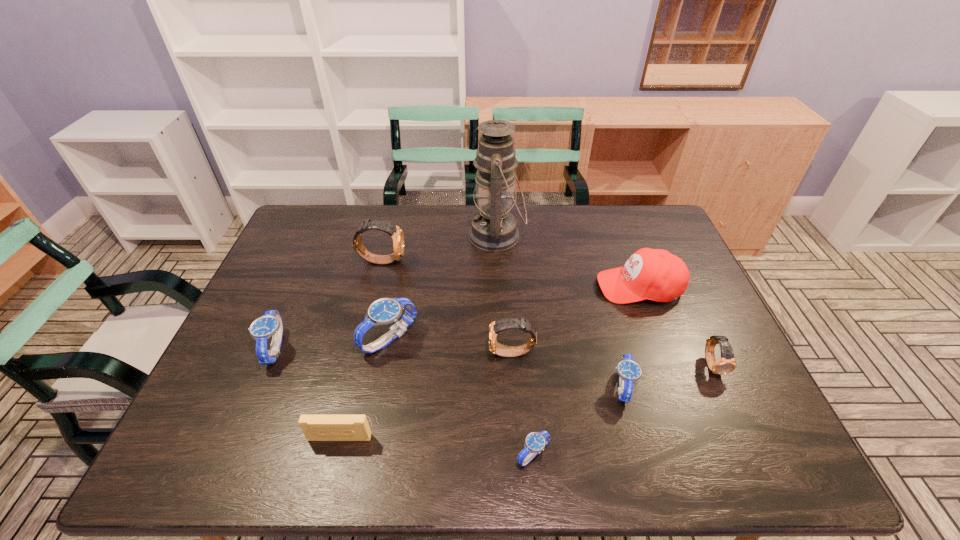
This screenshot has width=960, height=540. Identify the location of vacant space situated on the face of the second gold watch from right to left. (446, 353).

Locate an element on the screen. The height and width of the screenshot is (540, 960). vacant space located 0.160m on the face of the second gold watch from right to left is located at coordinates (427, 353).

Locate an element on the screen. vacant space situated 0.250m on the face of the second gold watch from right to left is located at coordinates (393, 353).

Identify the location of vacant space located 0.280m on the front of the biggest blue watch. This screenshot has width=960, height=540. (364, 471).

At what (x,y) coordinates should I click in order to perform the action: click on free space located 0.170m on the front of the leftmost watch. Please return your answer as a coordinate pair (x, y). The height and width of the screenshot is (540, 960). Looking at the image, I should click on (238, 437).

Locate an element on the screen. Image resolution: width=960 pixels, height=540 pixels. blank space located 0.200m on the face of the rightmost gold watch is located at coordinates (756, 460).

At what (x,y) coordinates should I click in order to perform the action: click on free space located 0.060m at the front of the beige videotape with spools. Please return your answer as a coordinate pair (x, y). The height and width of the screenshot is (540, 960). Looking at the image, I should click on (331, 470).

The width and height of the screenshot is (960, 540). I want to click on blank space located on the left of the rightmost blue watch, so click(x=561, y=387).

Locate an element on the screen. The height and width of the screenshot is (540, 960). blank space located on the right of the shortest object is located at coordinates click(736, 454).

The image size is (960, 540). Find the location of `object present at the far edge`. object present at the far edge is located at coordinates (493, 229).